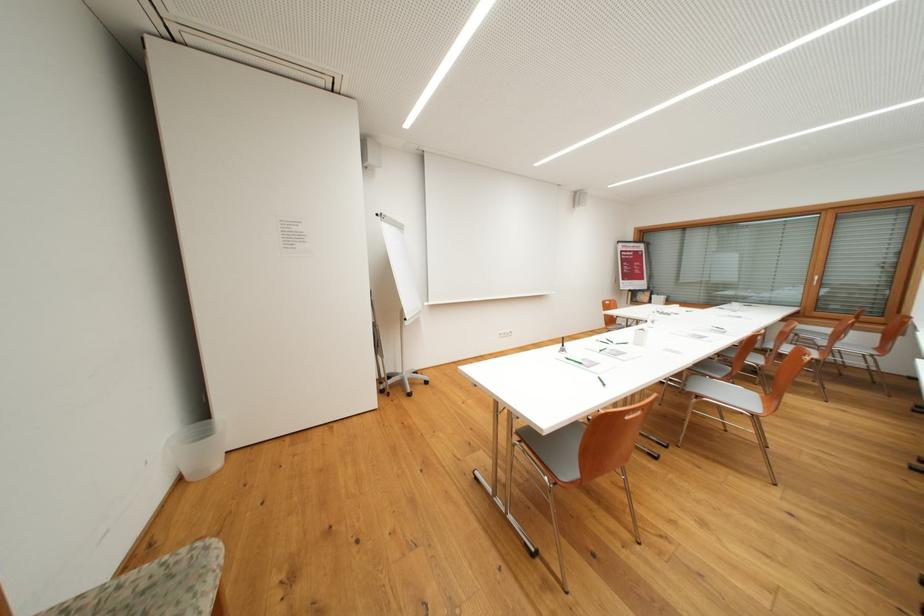
Which object does [639,336] point to?

It refers to a white sanitizer bottle.